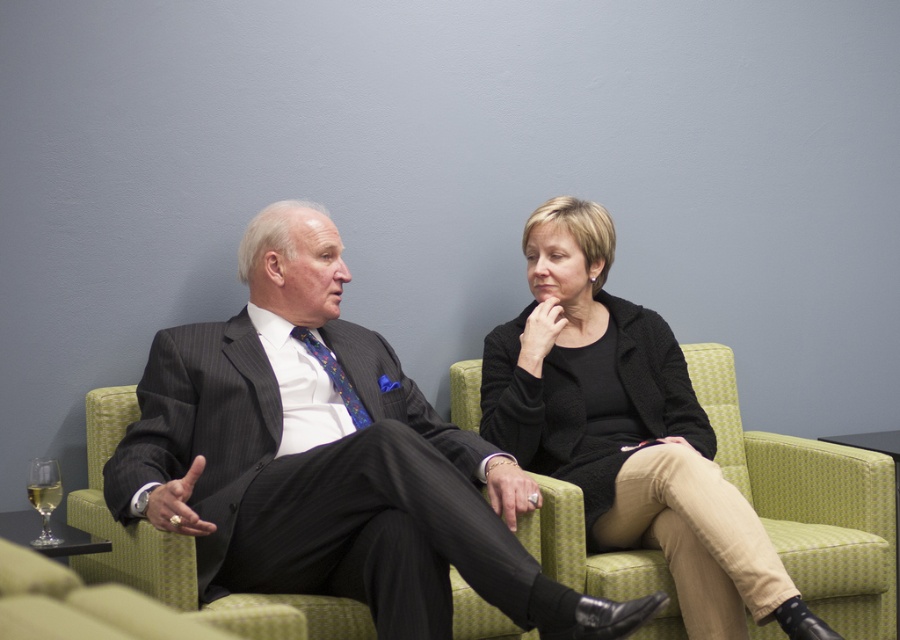
Question: Among these points, which one is farthest from the camera?

Choices:
 (A) (245, 257)
 (B) (47, 474)
 (C) (627, 536)

Answer: (A)

Question: Which point is closer to the camera?

Choices:
 (A) black woolen sweater at upper right
 (B) matte black suit at center

Answer: (B)

Question: Can you confirm if black woolen sweater at upper right is positioned below clear glass wine glass at lower left?

Choices:
 (A) no
 (B) yes

Answer: (A)

Question: Which point is farther from the camera taking this photo?

Choices:
 (A) (675, 477)
 (B) (33, 483)

Answer: (A)

Question: Can you confirm if matte black suit at center is smaller than clear glass wine glass at lower left?

Choices:
 (A) yes
 (B) no

Answer: (B)

Question: Does black woolen sweater at upper right appear over clear glass wine glass at lower left?

Choices:
 (A) yes
 (B) no

Answer: (A)